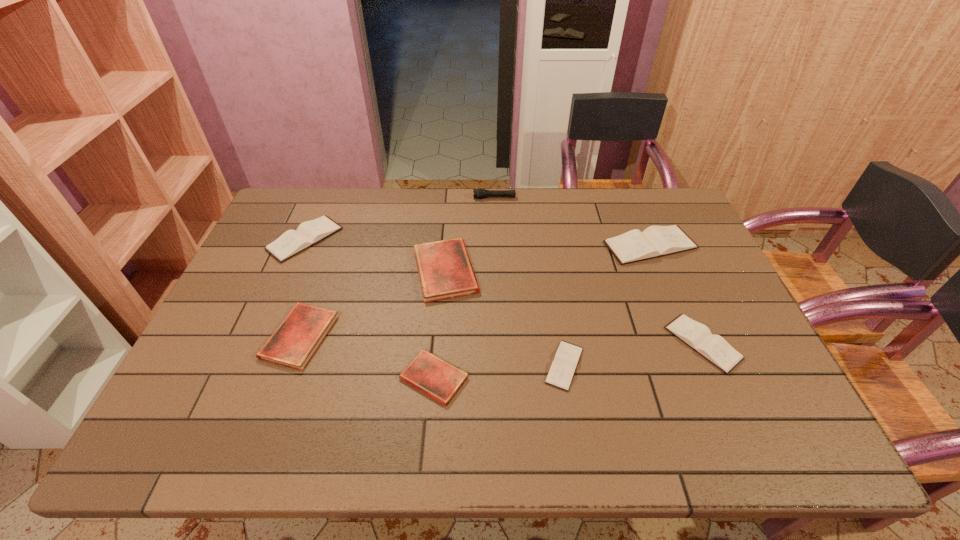
Image resolution: width=960 pixels, height=540 pixels. I want to click on object situated at the far left corner, so click(x=292, y=242).

The width and height of the screenshot is (960, 540). I want to click on object located at the far right corner, so click(x=655, y=241).

Identify the location of free location at the far edge. pos(337,222).

Find the location of a particular element. This screenshot has height=540, width=960. free spot at the near edge of the desktop is located at coordinates (578, 433).

Find the location of `vacant region at the left edge`. vacant region at the left edge is located at coordinates (262, 244).

Where is `free space at the right edge of the desktop`? free space at the right edge of the desktop is located at coordinates (669, 266).

In the image, there is a desktop. Find the location of `vacant space at the far left corner`. vacant space at the far left corner is located at coordinates (265, 229).

The height and width of the screenshot is (540, 960). I want to click on vacant space at the far right corner of the desktop, so click(666, 191).

The image size is (960, 540). Find the location of `vacant space that's between the leftmost red diary and the smallest red diary`. vacant space that's between the leftmost red diary and the smallest red diary is located at coordinates (367, 357).

Locate an element on the screen. The image size is (960, 540). free space between the farthest object and the biggest red diary is located at coordinates (469, 234).